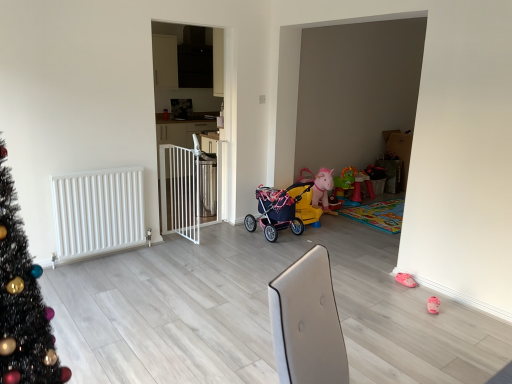
Question: From a real-world perspective, is white plastic gate at center positioned above or below pink fabric baby carriage at center?

Choices:
 (A) above
 (B) below

Answer: (A)

Question: Looking at their shapes, would you say white plastic gate at center is wider or thinner than pink fabric baby carriage at center?

Choices:
 (A) wide
 (B) thin

Answer: (B)

Question: Which of these objects is positioned farthest from the white matte radiator at left?

Choices:
 (A) matte pink stroller at center
 (B) white plastic gate at center
 (C) pink fabric baby carriage at center
 (D) white metal gate at center

Answer: (D)

Question: Which is farther from the pink fabric baby carriage at center?

Choices:
 (A) matte pink stroller at center
 (B) white metal gate at center
 (C) white plastic gate at center
 (D) white matte radiator at left

Answer: (B)